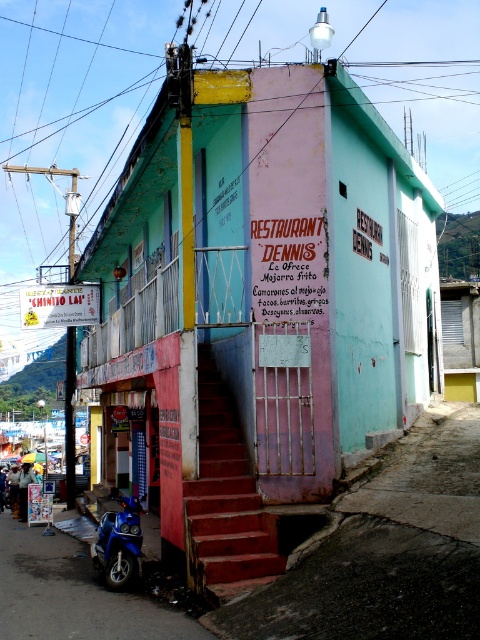
Question: Is blue metallic motorcycle at lower left above red painted stairs at center?

Choices:
 (A) yes
 (B) no

Answer: (B)

Question: Observing the image, what is the correct spatial positioning of blue metallic motorcycle at lower left in reference to blue glossy motorcycle at lower left?

Choices:
 (A) below
 (B) above

Answer: (A)

Question: Which object is the farthest from the blue metallic motorcycle at lower left?

Choices:
 (A) blue glossy motorcycle at lower left
 (B) red painted stairs at center

Answer: (B)

Question: Estimate the real-world distances between objects in this image. Which object is closer to the blue metallic motorcycle at lower left?

Choices:
 (A) red painted stairs at center
 (B) blue glossy motorcycle at lower left

Answer: (B)

Question: Based on their relative distances, which object is farther from the blue glossy motorcycle at lower left?

Choices:
 (A) blue metallic motorcycle at lower left
 (B) red painted stairs at center

Answer: (A)

Question: Is blue metallic motorcycle at lower left to the right of red painted stairs at center from the viewer's perspective?

Choices:
 (A) yes
 (B) no

Answer: (B)